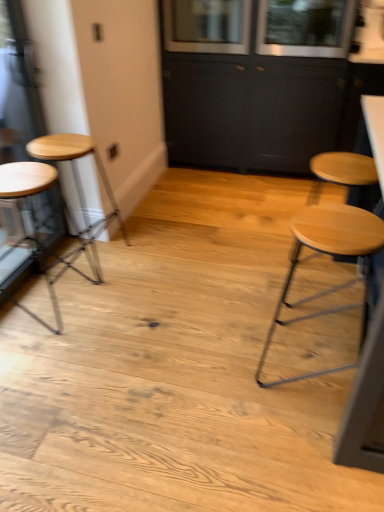
Identify the location of blank space situated above wooden stool at left, the third stool in the right-to-left sequence (from a real-world perspective). (18, 175).